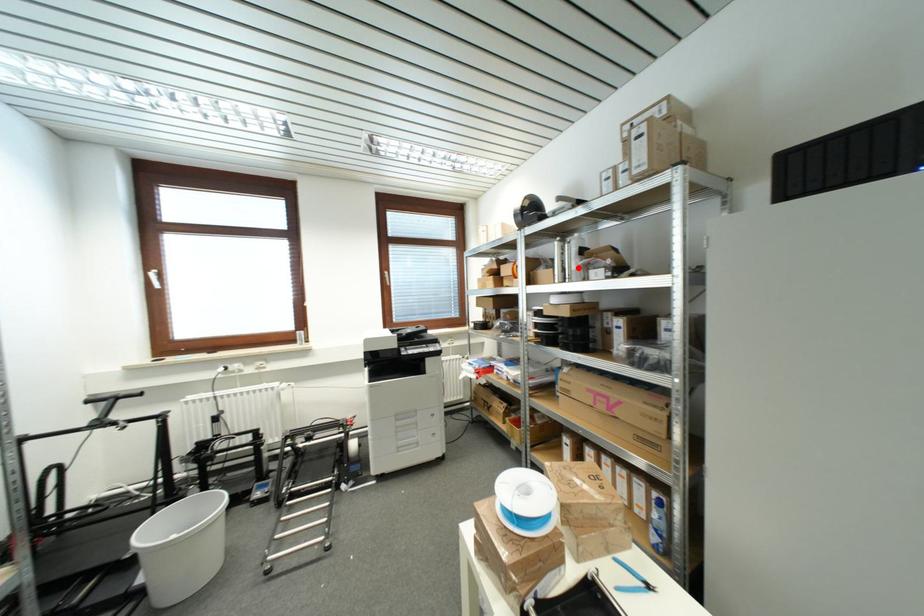
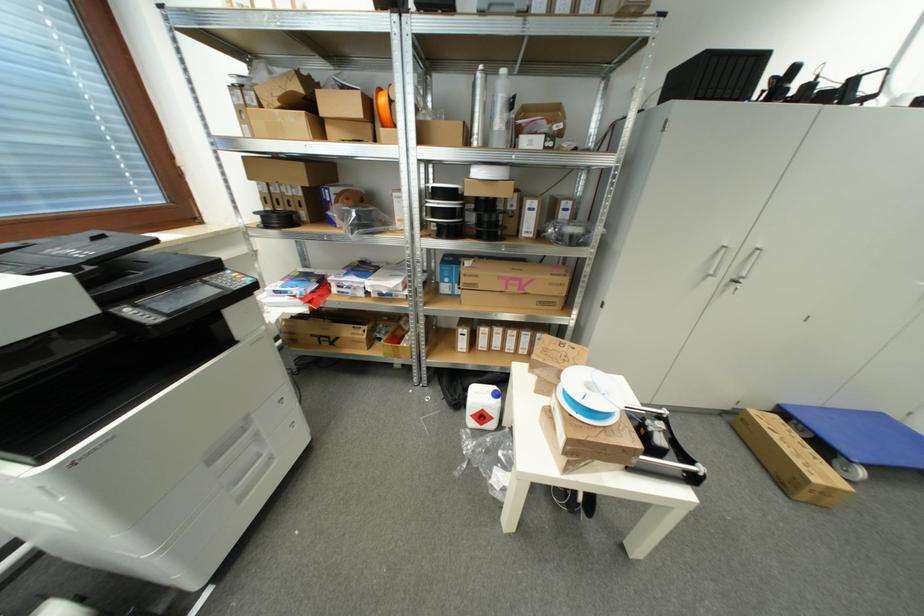
Find the pixel in the second image that matches the highlighted location in the first image.

(504, 126)